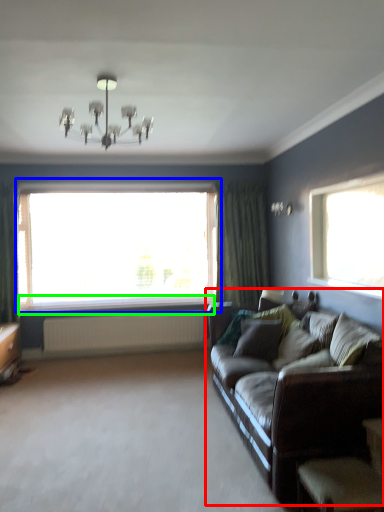
Question: Estimate the real-world distances between objects in this image. Which object is closer to studio couch (highlighted by a red box), window (highlighted by a blue box) or window sill (highlighted by a green box)?

Choices:
 (A) window
 (B) window sill

Answer: (A)